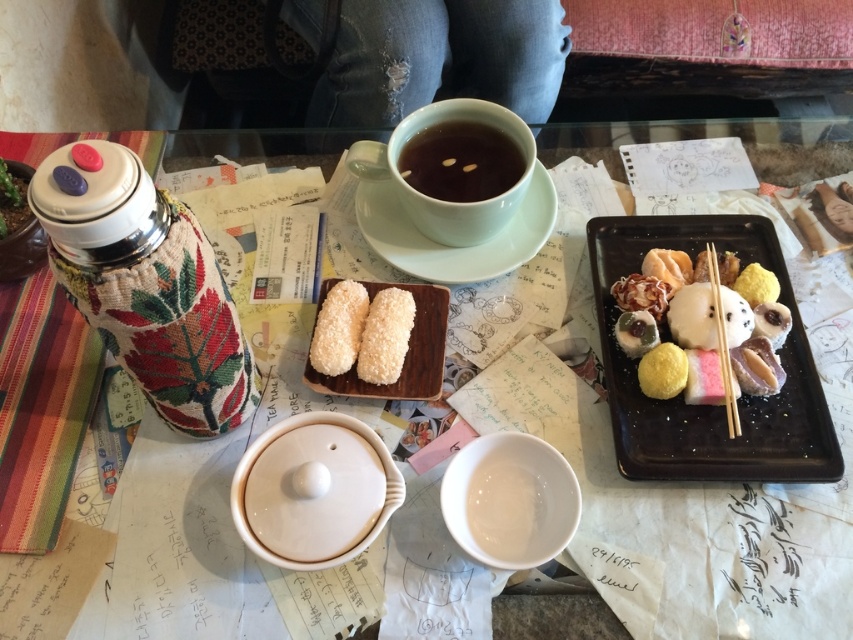
Question: Does white coconut-coated pastry at center appear on the right side of white glossy rice ball at center?

Choices:
 (A) no
 (B) yes

Answer: (A)

Question: Which point is closer to the camera?

Choices:
 (A) slightly translucent brown meat at center
 (B) white ceramic saucer at center
 (C) white fluffy pastry at right

Answer: (A)

Question: Estimate the real-world distances between objects in this image. Which object is closer to the white coconut-coated pastry at center?

Choices:
 (A) white fluffy pastry at center
 (B) black matte tray at center
 (C) shiny silver dumpling at center right

Answer: (A)

Question: Does brown matte cup at upper center appear under white fluffy pastry at right?

Choices:
 (A) no
 (B) yes

Answer: (A)

Question: Which point appears closest to the camera in this image?

Choices:
 (A) (480, 152)
 (B) (770, 358)

Answer: (B)

Question: Does white coconut-covered pastry at center appear under yellow matte rice ball at center-right?

Choices:
 (A) yes
 (B) no

Answer: (B)